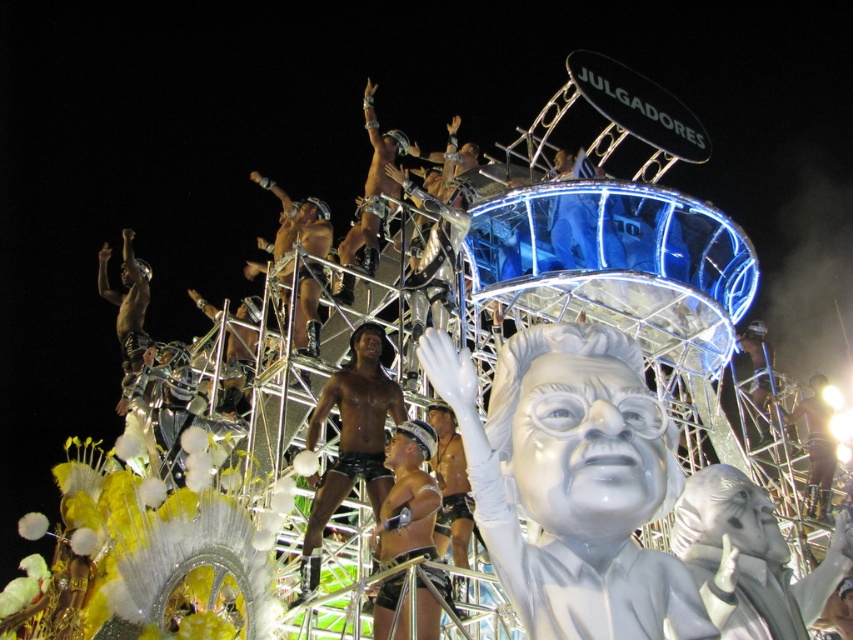
You are a photographer at the carnival trying to capture the performers. You notice the white glossy statue at center and the shiny black shorts at center. Which object is closer to your camera lens?

The white glossy statue at center is in front of the shiny black shorts at center, so it is closer to the camera lens.

You are a photographer at the carnival and want to capture the performers. You notice the shiny black shorts at center. Where exactly should you aim your camera to ensure the shorts are in the frame?

You should aim your camera at point (351,440) to capture the shiny black shorts at center as they are located there.